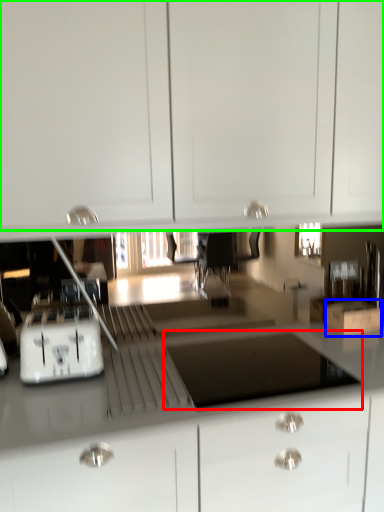
Question: Which object is the farthest from appliance (highlighted by a red box)? Choose among these: cardboard box (highlighted by a blue box) or cabinetry (highlighted by a green box).

Choices:
 (A) cardboard box
 (B) cabinetry

Answer: (B)